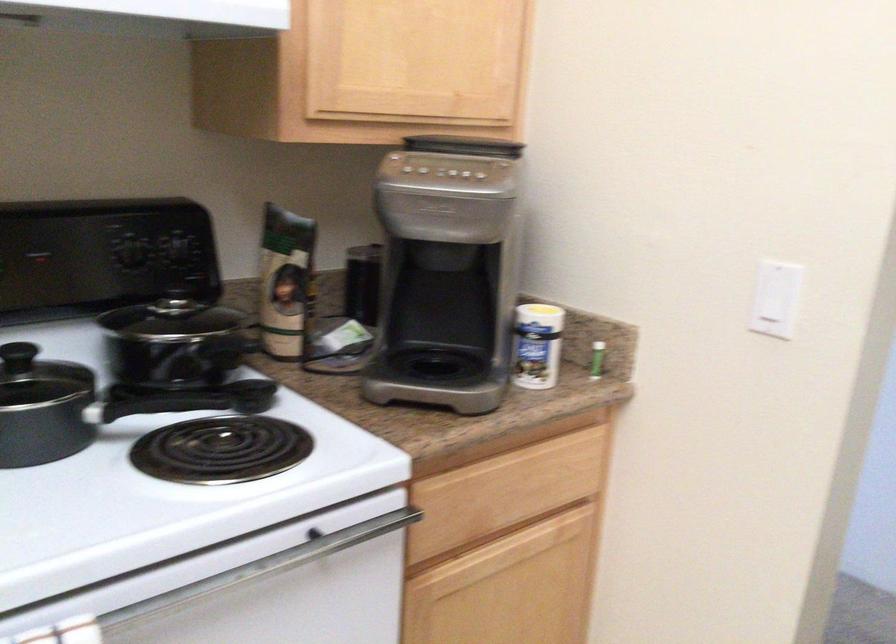
What do you see at coordinates (286, 281) in the screenshot? I see `the bag of coffee` at bounding box center [286, 281].